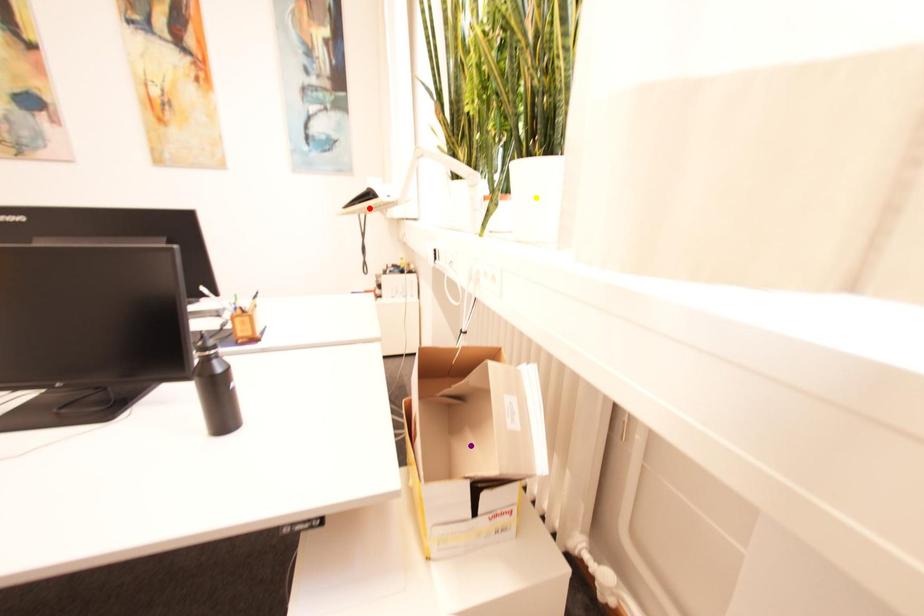
Order these from nearest to farthest:
- red point
- purple point
- yellow point

1. purple point
2. yellow point
3. red point